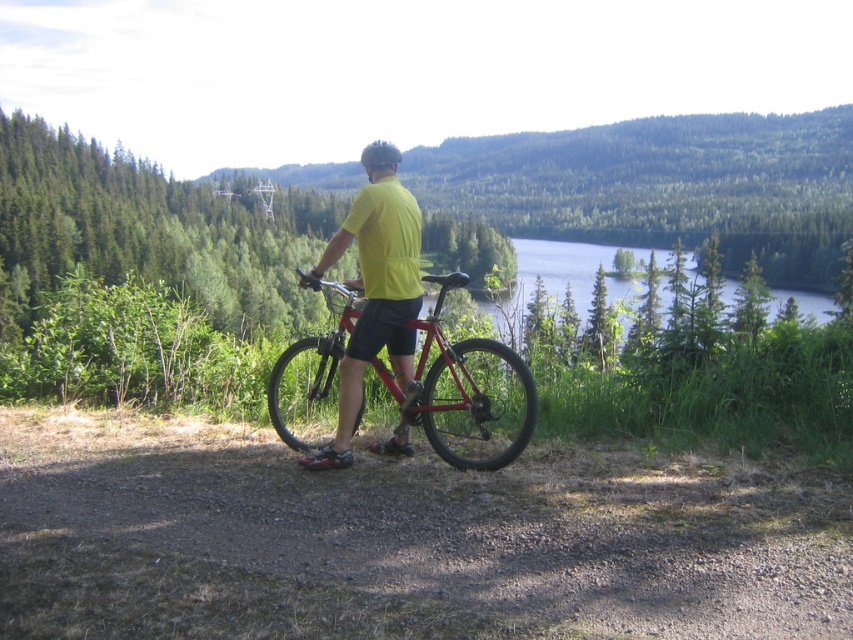
Is dirt/gravel path at center closer to camera compared to shiny metallic bicycle at center?

That is True.

Which is more to the right, dirt/gravel path at center or shiny metallic bicycle at center?

From the viewer's perspective, dirt/gravel path at center appears more on the right side.

Locate an element on the screen. dirt/gravel path at center is located at coordinates (399, 540).

The width and height of the screenshot is (853, 640). I want to click on dirt/gravel path at center, so click(399, 540).

From the picture: Does shiny metallic bicycle at center appear on the left side of yellow matte shirt at center?

Yes, shiny metallic bicycle at center is to the left of yellow matte shirt at center.

Does shiny metallic bicycle at center have a greater height compared to yellow matte shirt at center?

No.

Looking at this image, who is more forward, (467, 468) or (341, 404)?

Point (467, 468) is more forward.

Where is `shiny metallic bicycle at center`? shiny metallic bicycle at center is located at coordinates [x=473, y=394].

Does point (281, 538) come closer to viewer compared to point (403, 196)?

That is True.

Is point (267, 445) in front of point (317, 268)?

That is False.

Find the location of a particular element. dirt/gravel path at center is located at coordinates (399, 540).